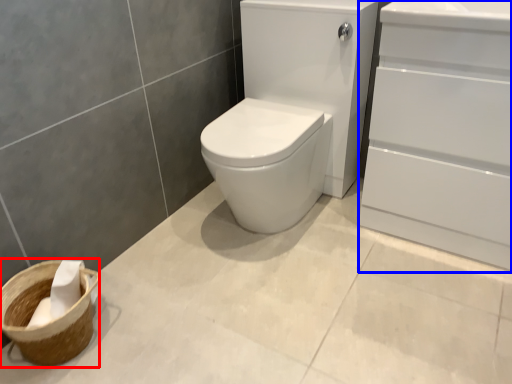
Question: Among these objects, which one is nearest to the camera, basket container (highlighted by a red box) or screen door (highlighted by a blue box)?

Choices:
 (A) basket container
 (B) screen door

Answer: (B)